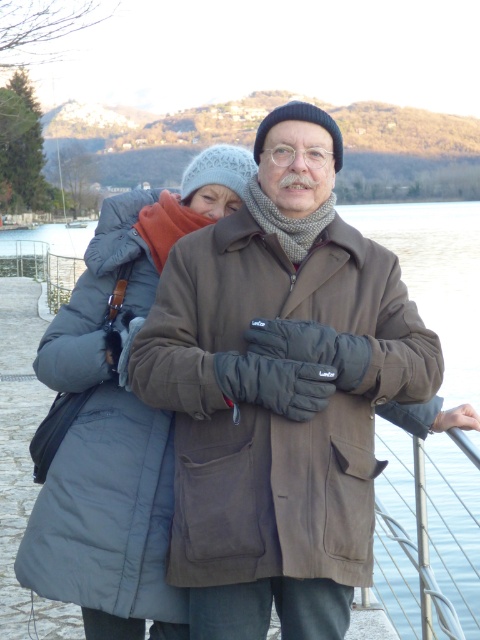
Is brown suede coat at center behind gray puffy coat at center?

No.

Looking at this image, which of these two, brown suede coat at center or gray puffy coat at center, stands taller?

Standing taller between the two is brown suede coat at center.

Where is `brown suede coat at center`? The image size is (480, 640). brown suede coat at center is located at coordinates click(279, 392).